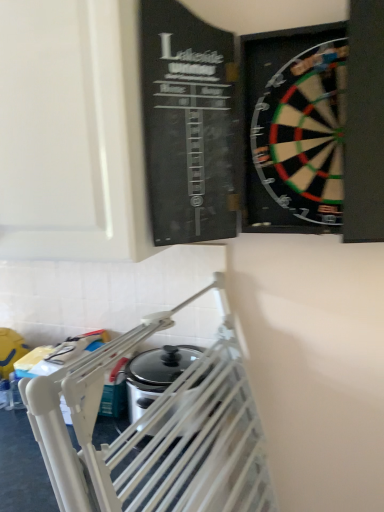
Consider the image. Measure the distance between point (142, 352) and camera.

They are 1.32 meters apart.

The image size is (384, 512). Describe the element at coordinates (155, 375) in the screenshot. I see `metallic silver slow cooker at center` at that location.

I want to click on metallic silver slow cooker at center, so click(155, 375).

What are the coordinates of `metallic silver slow cooker at center` in the screenshot? It's located at (155, 375).